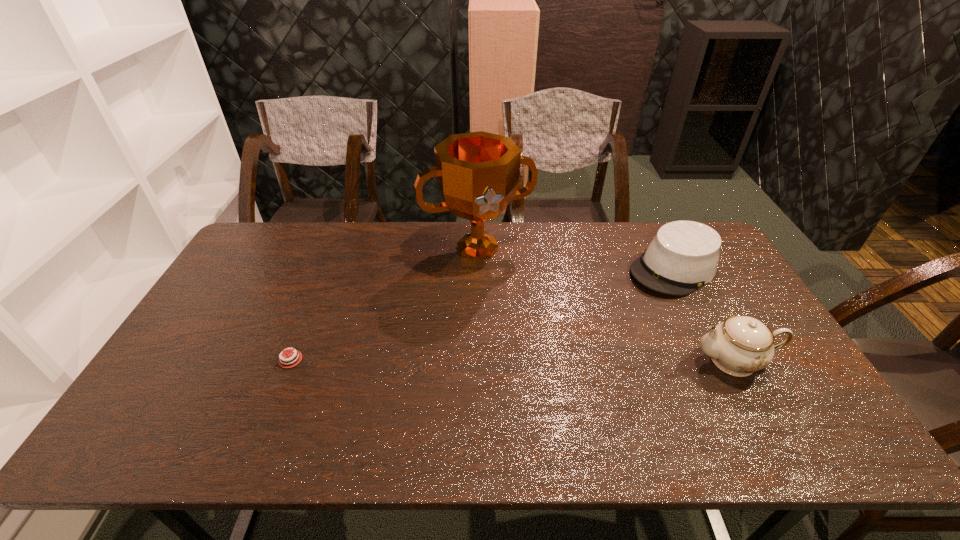
At what (x,y) coordinates should I click in order to perform the action: click on empty space between the second tallest object and the second object from left to right. Please return your answer as a coordinate pair (x, y). Image resolution: width=960 pixels, height=540 pixels. Looking at the image, I should click on (606, 304).

Locate an element on the screen. This screenshot has height=540, width=960. empty location between the third tallest object and the leftmost object is located at coordinates (482, 314).

The width and height of the screenshot is (960, 540). I want to click on vacant area that lies between the second tallest object and the hat, so click(x=704, y=315).

The image size is (960, 540). I want to click on free space that is in between the chinaware and the hat, so click(704, 315).

Locate an element on the screen. blank region between the third tallest object and the leftmost object is located at coordinates (482, 314).

Find the location of a particular element. Image resolution: width=960 pixels, height=540 pixels. vacant area that lies between the tallest object and the shortest object is located at coordinates (384, 303).

At what (x,y) coordinates should I click in order to perform the action: click on empty space between the hat and the third shortest object. Please return your answer as a coordinate pair (x, y). This screenshot has width=960, height=540. Looking at the image, I should click on (704, 315).

Find the location of a particular element. This screenshot has height=540, width=960. blank region between the second shortest object and the tallest object is located at coordinates [575, 258].

At what (x,y) coordinates should I click in order to perform the action: click on object that is the third nearest to the award. Please return your answer as a coordinate pair (x, y). Looking at the image, I should click on (740, 345).

Identify the location of object that is the closest to the third shortest object. (683, 256).